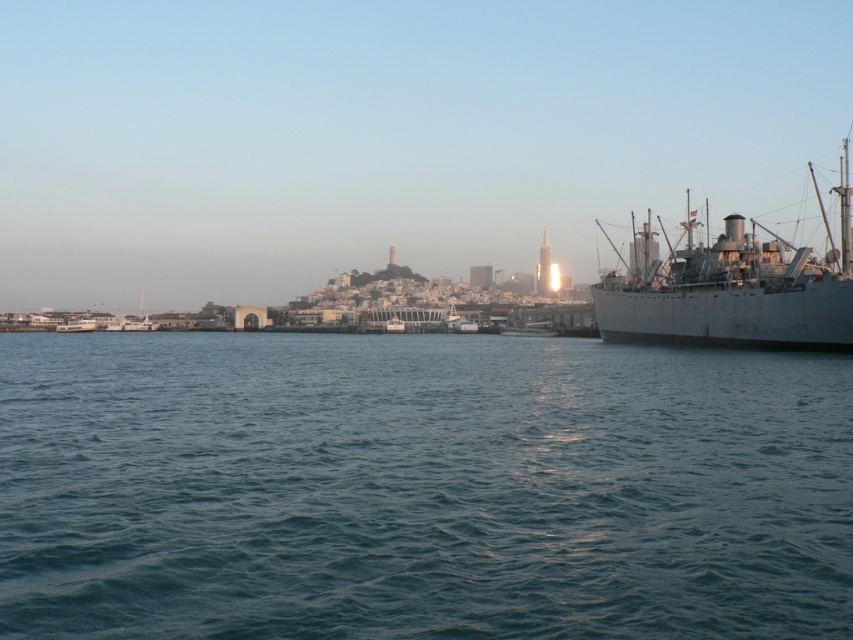
Does metallic gray boat at left come behind metallic gray ferry at left?

Yes.

Does metallic gray boat at left have a lesser width compared to metallic gray ferry at left?

Incorrect, metallic gray boat at left's width is not less than metallic gray ferry at left's.

Who is more forward, (142, 326) or (65, 324)?

Positioned in front is point (65, 324).

Identify the location of metallic gray boat at left. Image resolution: width=853 pixels, height=640 pixels. (131, 324).

Can you confirm if gray metallic ship at right is positioned to the left of metallic gray boat at left?

No, gray metallic ship at right is not to the left of metallic gray boat at left.

Who is taller, gray metallic ship at right or metallic gray boat at left?

Standing taller between the two is gray metallic ship at right.

What do you see at coordinates (735, 292) in the screenshot? I see `gray metallic ship at right` at bounding box center [735, 292].

What are the coordinates of `gray metallic ship at right` in the screenshot? It's located at (735, 292).

Is point (621, 278) more distant than point (85, 324)?

No.

Is gray metallic ship at right above metallic gray ferry at left?

Yes.

Is point (642, 307) positioned after point (80, 317)?

No, (642, 307) is closer to viewer.

This screenshot has width=853, height=640. What are the coordinates of `gray metallic ship at right` in the screenshot? It's located at (735, 292).